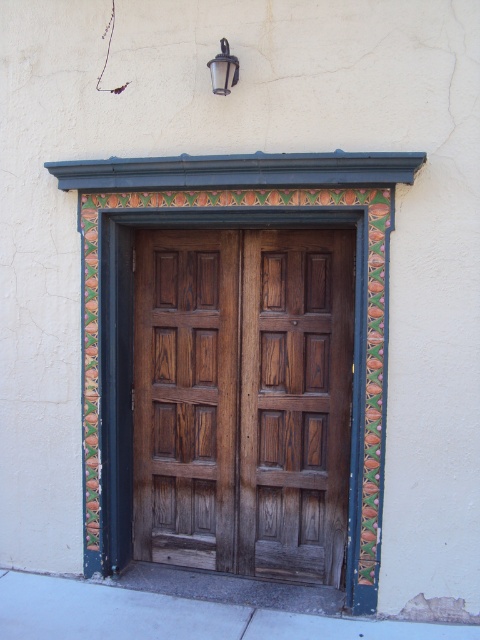
You are standing in front of the double wooden doors. A point marked at coordinates [242,400] is on the wooden panelled door at center. If you want to open the door, should you push or pull?

The point marked at [242,400] is on the wooden panelled door at center. Since the doors are double and centered, you should push the door open as handles or pulls are typically on the opposite side if this point is on the panel.

You are standing in front of the doorway and want to place a new decorative item between the wooden panelled door at center and the matte glass lamp at upper center. Based on their positions, which object should the item be placed closer to?

The item should be placed closer to the matte glass lamp at upper center because the wooden panelled door at center is to the right of the matte glass lamp at upper center, meaning the door is positioned farther to the right side relative to the lamp.

You are standing in front of the doorway and want to install a new decorative hook. The hook needs to be placed above the wooden panelled door at center but below the matte glass lamp at upper center. Is there enough space between them to place the hook?

The wooden panelled door at center is below the matte glass lamp at upper center, so there is space between them. The hook can be placed in that space.